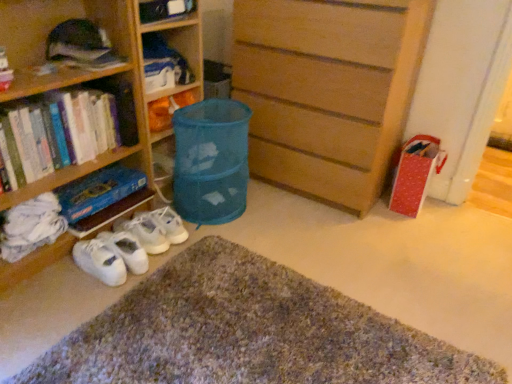
Question: Considering the relative sizes of wooden chest of drawers at center and hardcover book at lower left, marked as the third book in a top-to-bottom arrangement, in the image provided, is wooden chest of drawers at center wider than hardcover book at lower left, marked as the third book in a top-to-bottom arrangement,?

Choices:
 (A) yes
 (B) no

Answer: (A)

Question: Considering the relative sizes of wooden chest of drawers at center and hardcover book at lower left, marked as the third book in a top-to-bottom arrangement, in the image provided, is wooden chest of drawers at center shorter than hardcover book at lower left, marked as the third book in a top-to-bottom arrangement,?

Choices:
 (A) yes
 (B) no

Answer: (B)

Question: Can you confirm if wooden chest of drawers at center is thinner than hardcover book at lower left, marked as the third book in a top-to-bottom arrangement?

Choices:
 (A) yes
 (B) no

Answer: (B)

Question: From the image's perspective, would you say wooden chest of drawers at center is positioned over hardcover book at lower left, marked as the third book in a top-to-bottom arrangement?

Choices:
 (A) no
 (B) yes

Answer: (B)

Question: Is wooden chest of drawers at center far from hardcover book at lower left, marked as the third book in a top-to-bottom arrangement?

Choices:
 (A) yes
 (B) no

Answer: (B)

Question: Relative to matte plastic bag at center, the 4th book ordered from the bottom, is textured woolen doormat at lower center in front or behind?

Choices:
 (A) front
 (B) behind

Answer: (A)

Question: Would you say textured woolen doormat at lower center is inside or outside matte plastic bag at center, the 4th book ordered from the bottom?

Choices:
 (A) outside
 (B) inside

Answer: (A)

Question: In the image, is textured woolen doormat at lower center on the left side or the right side of matte plastic bag at center, the 4th book ordered from the bottom?

Choices:
 (A) left
 (B) right

Answer: (B)

Question: From a real-world perspective, is textured woolen doormat at lower center positioned above or below matte plastic bag at center, the 4th book ordered from the bottom?

Choices:
 (A) below
 (B) above

Answer: (A)

Question: In terms of height, does hardcover books at left, positioned as the third book in bottom-to-top order, look taller or shorter compared to hardcover book at lower left, the 2th book positioned from the bottom?

Choices:
 (A) tall
 (B) short

Answer: (B)

Question: Is hardcover books at left, arranged as the 2th book when viewed from the top, bigger or smaller than hardcover book at lower left, marked as the third book in a top-to-bottom arrangement?

Choices:
 (A) small
 (B) big

Answer: (A)

Question: Considering the positions of hardcover books at left, arranged as the 2th book when viewed from the top, and hardcover book at lower left, the 2th book positioned from the bottom, in the image, is hardcover books at left, arranged as the 2th book when viewed from the top, wider or thinner than hardcover book at lower left, the 2th book positioned from the bottom,?

Choices:
 (A) thin
 (B) wide

Answer: (A)

Question: Is point (115, 125) closer or farther from the camera than point (144, 198)?

Choices:
 (A) farther
 (B) closer

Answer: (B)

Question: Is blue fabric laundry basket at center bigger or smaller than white cloth at lower left, which is the fourth book in top-to-bottom order?

Choices:
 (A) small
 (B) big

Answer: (B)

Question: Relative to white cloth at lower left, the first book when ordered from bottom to top, is blue fabric laundry basket at center in front or behind?

Choices:
 (A) front
 (B) behind

Answer: (B)